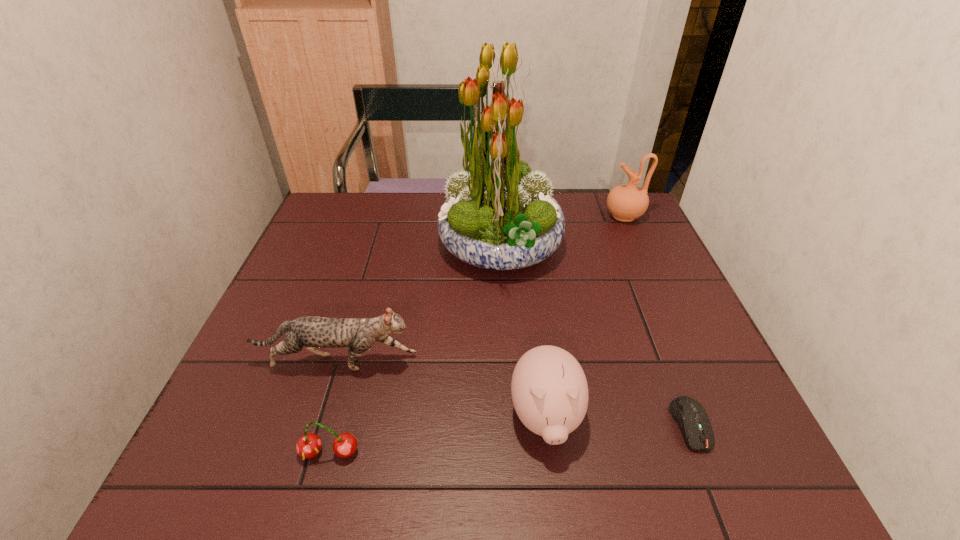
This screenshot has width=960, height=540. In order to click on pottery situated at the right edge in this screenshot , I will do `click(627, 202)`.

At what (x,y) coordinates should I click in order to perform the action: click on computer equipment positioned at the right edge. Please return your answer as a coordinate pair (x, y). The height and width of the screenshot is (540, 960). Looking at the image, I should click on (692, 419).

Find the location of a particular element. object at the far right corner is located at coordinates (627, 202).

Find the location of `object positioned at the near right corner`. object positioned at the near right corner is located at coordinates (692, 419).

This screenshot has height=540, width=960. In order to click on free space at the far edge of the desktop in this screenshot , I will do [377, 211].

At what (x,y) coordinates should I click in order to perform the action: click on free region at the near edge of the desktop. Please return your answer as a coordinate pair (x, y). Looking at the image, I should click on point(406,488).

In the image, there is a desktop. Identify the location of vacant space at the left edge. This screenshot has width=960, height=540. (305, 279).

Image resolution: width=960 pixels, height=540 pixels. What are the coordinates of `vacant region at the right edge of the desktop` in the screenshot? It's located at (672, 284).

Image resolution: width=960 pixels, height=540 pixels. In the image, there is a desktop. In order to click on vacant space at the far left corner in this screenshot , I will do `click(314, 228)`.

Locate an element on the screen. The image size is (960, 540). vacant space at the near left corner of the desktop is located at coordinates (201, 455).